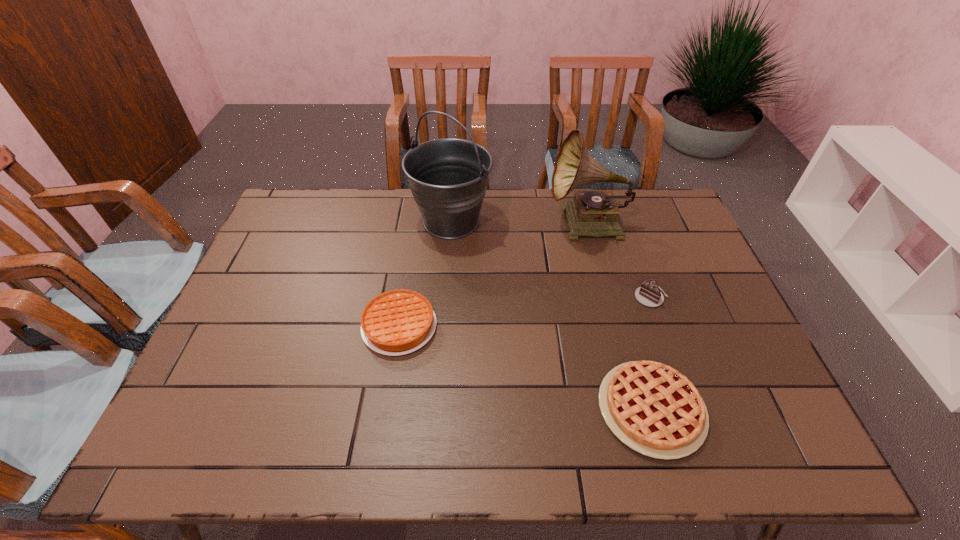
Where is `vacant space located on the back of the left pie`? vacant space located on the back of the left pie is located at coordinates (410, 260).

You are a GUI agent. You are given a task and a screenshot of the screen. Output one action in this format:
    pyautogui.click(x=<x>, y=<y>)
    Task: Click on the vacant area situated on the left of the chocolate cake
    Image resolution: width=960 pixels, height=540 pixels.
    Given the screenshot: What is the action you would take?
    pyautogui.click(x=596, y=298)

At what (x,y) coordinates should I click in order to perform the action: click on vacant space located 0.170m on the left of the nearest object. Please return your answer as a coordinate pair (x, y). Looking at the image, I should click on (525, 409).

The height and width of the screenshot is (540, 960). Identify the location of bucket located at the far edge. (448, 177).

Locate an element on the screen. The image size is (960, 540). record player that is at the far edge is located at coordinates (595, 213).

Locate an element on the screen. This screenshot has width=960, height=540. object present at the near edge is located at coordinates (652, 408).

I want to click on object that is at the right edge, so click(648, 294).

Where is `vacant space at the far edge`? The image size is (960, 540). vacant space at the far edge is located at coordinates (508, 225).

Identify the location of free space at the near edge. The image size is (960, 540). (719, 461).

Where is `vacant region at the left edge`? This screenshot has height=540, width=960. vacant region at the left edge is located at coordinates (238, 335).